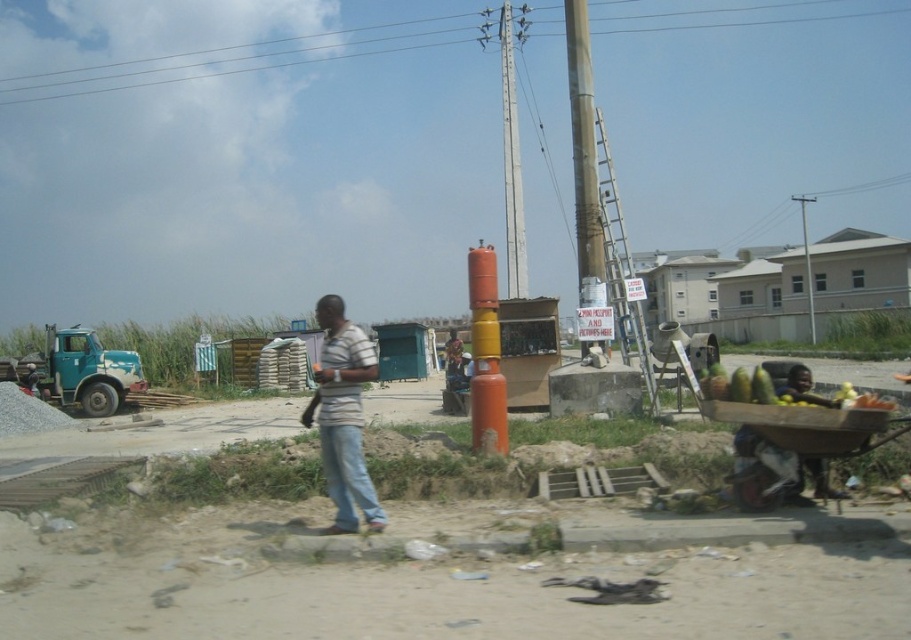
Is smooth metallic pole at center above blue denim jeans at center?

Yes.

Can you confirm if smooth metallic pole at center is shorter than blue denim jeans at center?

In fact, smooth metallic pole at center may be taller than blue denim jeans at center.

In order to click on smooth metallic pole at center in this screenshot , I will do `click(582, 152)`.

I want to click on smooth metallic pole at center, so click(x=582, y=152).

Is brushed metal power line at upper center above smooth metallic pole at center?

Yes.

Does brushed metal power line at upper center appear on the left side of smooth metallic pole at center?

Correct, you'll find brushed metal power line at upper center to the left of smooth metallic pole at center.

The height and width of the screenshot is (640, 911). What are the coordinates of `brushed metal power line at upper center` in the screenshot? It's located at (233, 60).

Find the location of `brushed metal power line at upper center`. brushed metal power line at upper center is located at coordinates (233, 60).

Who is positioned more to the left, brushed metal power line at upper center or metallic gray telegraph pole at center?

From the viewer's perspective, metallic gray telegraph pole at center appears more on the left side.

The width and height of the screenshot is (911, 640). I want to click on brushed metal power line at upper center, so click(x=233, y=60).